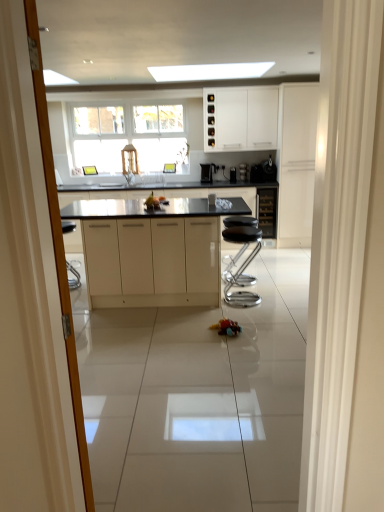
Question: Could you tell me if black granite countertop at center is turned towards matte black cabinet at center, placed as the second cabinetry when sorted from left to right?

Choices:
 (A) yes
 (B) no

Answer: (B)

Question: From the image's perspective, is black granite countertop at center under matte black cabinet at center, placed as the second cabinetry when sorted from left to right?

Choices:
 (A) no
 (B) yes

Answer: (B)

Question: Considering the relative sizes of black granite countertop at center and matte black cabinet at center, placed as the second cabinetry when sorted from left to right, in the image provided, is black granite countertop at center bigger than matte black cabinet at center, placed as the second cabinetry when sorted from left to right,?

Choices:
 (A) yes
 (B) no

Answer: (A)

Question: Considering the relative positions of black granite countertop at center and matte black cabinet at center, positioned as the 2th cabinetry in right-to-left order, in the image provided, is black granite countertop at center to the left of matte black cabinet at center, positioned as the 2th cabinetry in right-to-left order, from the viewer's perspective?

Choices:
 (A) no
 (B) yes

Answer: (B)

Question: Can you confirm if black granite countertop at center is taller than matte black cabinet at center, placed as the second cabinetry when sorted from left to right?

Choices:
 (A) yes
 (B) no

Answer: (A)

Question: From a real-world perspective, is rubberized plastic toy car at center physically located above or below satin black coffee machine at center, which is the 1th coffee machine from left to right?

Choices:
 (A) above
 (B) below

Answer: (B)

Question: From the image's perspective, relative to satin black coffee machine at center, which is the 1th coffee machine from left to right, is rubberized plastic toy car at center above or below?

Choices:
 (A) above
 (B) below

Answer: (B)

Question: Is rubberized plastic toy car at center in front of or behind satin black coffee machine at center, which is the 1th coffee machine from left to right, in the image?

Choices:
 (A) front
 (B) behind

Answer: (A)

Question: From their relative heights in the image, would you say rubberized plastic toy car at center is taller or shorter than satin black coffee machine at center, the 2th coffee machine positioned from the right?

Choices:
 (A) short
 (B) tall

Answer: (A)

Question: Is metallic silver coffee machine at center, marked as the third appliance in a right-to-left arrangement, taller or shorter than satin black coffee machine at center, the second coffee machine in the left-to-right sequence?

Choices:
 (A) short
 (B) tall

Answer: (A)

Question: From a real-world perspective, relative to satin black coffee machine at center, arranged as the first coffee machine when viewed from the right, is metallic silver coffee machine at center, marked as the third appliance in a right-to-left arrangement, vertically above or below?

Choices:
 (A) above
 (B) below

Answer: (B)

Question: Based on their sizes in the image, would you say metallic silver coffee machine at center, which appears as the 1th appliance when viewed from the left, is bigger or smaller than satin black coffee machine at center, the second coffee machine in the left-to-right sequence?

Choices:
 (A) big
 (B) small

Answer: (B)

Question: Considering the positions of point (235, 179) and point (241, 165), is point (235, 179) closer or farther from the camera than point (241, 165)?

Choices:
 (A) farther
 (B) closer

Answer: (A)

Question: From the image's perspective, is white matte cabinet at right, the first cabinetry viewed from the right, positioned above or below white matte cabinet at upper center, acting as the 3th cabinetry starting from the right?

Choices:
 (A) below
 (B) above

Answer: (A)

Question: Looking at the image, does white matte cabinet at right, which is counted as the third cabinetry, starting from the left, seem bigger or smaller compared to white matte cabinet at upper center, arranged as the first cabinetry when viewed from the left?

Choices:
 (A) small
 (B) big

Answer: (B)